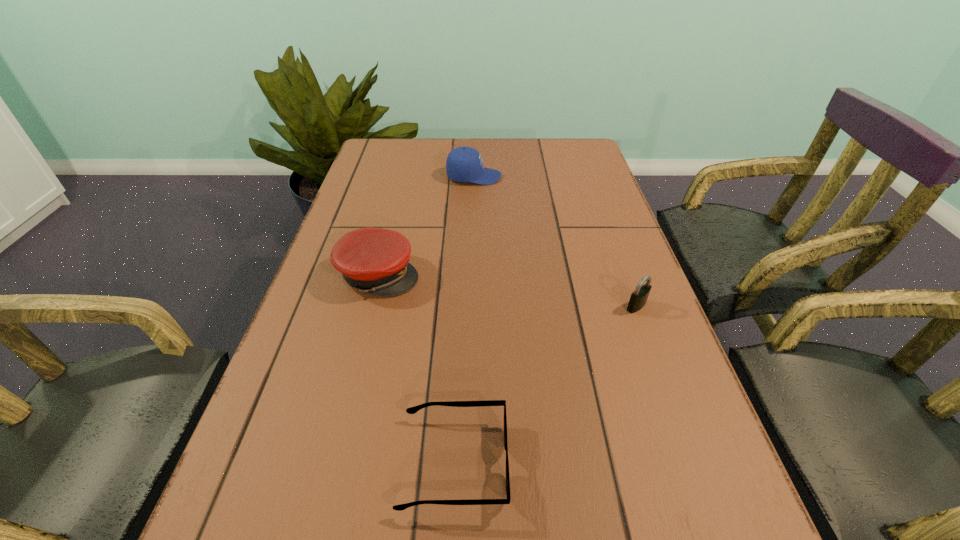
Identify the location of the closest object to the left cap. (412, 410).

Identify the location of vacant space that satisfies the following two spatial constraints: 1. on the front-facing side of the farthest object; 2. on the back side of the rightmost object. (471, 306).

Find the location of `vacant region that satisfies the following two spatial constraints: 1. on the front-facing side of the farther cap; 2. on the left side of the rightmost object`. vacant region that satisfies the following two spatial constraints: 1. on the front-facing side of the farther cap; 2. on the left side of the rightmost object is located at coordinates (471, 306).

Locate an element on the screen. vacant space that satisfies the following two spatial constraints: 1. on the back side of the padlock; 2. on the front-facing side of the right cap is located at coordinates (589, 177).

Locate an element on the screen. vacant position in the image that satisfies the following two spatial constraints: 1. on the front side of the rightmost object; 2. on the arms of the spectacles is located at coordinates (694, 463).

Image resolution: width=960 pixels, height=540 pixels. What are the coordinates of `vacant space that satisfies the following two spatial constraints: 1. on the front-facing side of the farthest object; 2. on the right side of the padlock` in the screenshot? It's located at (471, 306).

Find the location of a particular element. The width and height of the screenshot is (960, 540). vacant area in the image that satisfies the following two spatial constraints: 1. on the front of the nearer cap with an emblem; 2. on the back side of the padlock is located at coordinates (371, 306).

Locate an element on the screen. The image size is (960, 540). vacant position in the image that satisfies the following two spatial constraints: 1. on the front-facing side of the padlock; 2. on the left side of the farther cap is located at coordinates (471, 306).

Locate an element on the screen. The image size is (960, 540). vacant region that satisfies the following two spatial constraints: 1. on the front-facing side of the padlock; 2. on the left side of the farthest object is located at coordinates (471, 306).